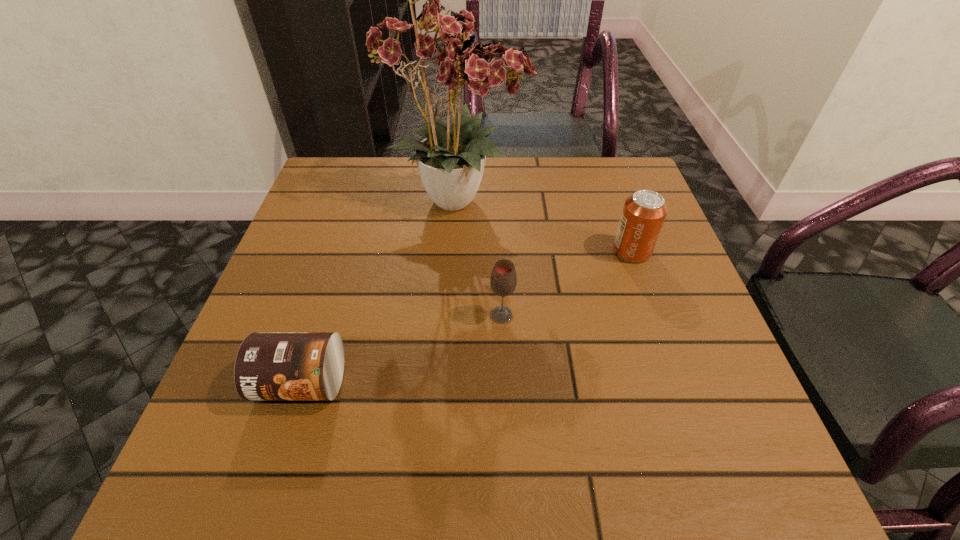
Find the location of a particular element. The image size is (960, 540). vacant region between the nearer can and the tallest object is located at coordinates (380, 291).

Where is `vacant region between the rightmost object and the glass drink container`? This screenshot has width=960, height=540. vacant region between the rightmost object and the glass drink container is located at coordinates (566, 283).

Find the location of a particular element. free space between the taller can and the nearer can is located at coordinates (467, 317).

Locate an element on the screen. The image size is (960, 540). unoccupied position between the farthest object and the shortest object is located at coordinates (380, 291).

Where is `vacant area that lies between the second nearest object and the farther can`? vacant area that lies between the second nearest object and the farther can is located at coordinates (566, 283).

Image resolution: width=960 pixels, height=540 pixels. In order to click on blank region between the second nearest object and the second farthest object in this screenshot , I will do `click(566, 283)`.

Where is `free spot between the glass drink container and the tallest object`? free spot between the glass drink container and the tallest object is located at coordinates (480, 257).

Find the location of a particular element. free space between the third farthest object and the farthest object is located at coordinates (480, 257).

This screenshot has height=540, width=960. Find the location of `vacant space that is in between the farther can and the third farthest object`. vacant space that is in between the farther can and the third farthest object is located at coordinates (566, 283).

Image resolution: width=960 pixels, height=540 pixels. I want to click on free space between the shorter can and the tallest object, so click(x=380, y=291).